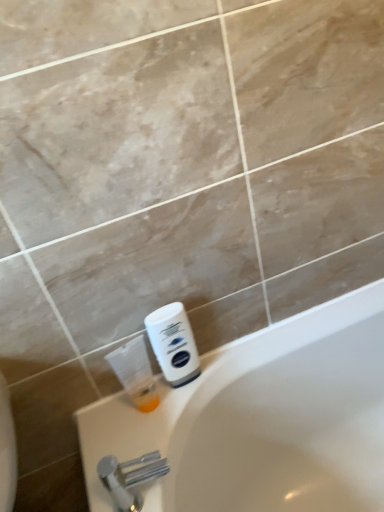
Question: From the image's perspective, is white matte shaving cream at lower right above or below silver metallic faucet at lower left?

Choices:
 (A) below
 (B) above

Answer: (B)

Question: In terms of width, does white matte shaving cream at lower right look wider or thinner when compared to silver metallic faucet at lower left?

Choices:
 (A) thin
 (B) wide

Answer: (A)

Question: Considering the real-world distances, which object is closest to the white matte shaving cream at lower right?

Choices:
 (A) translucent plastic bottle at lower left
 (B) silver metallic faucet at lower left

Answer: (A)

Question: Estimate the real-world distances between objects in this image. Which object is farther from the white matte shaving cream at lower right?

Choices:
 (A) silver metallic faucet at lower left
 (B) translucent plastic bottle at lower left

Answer: (A)